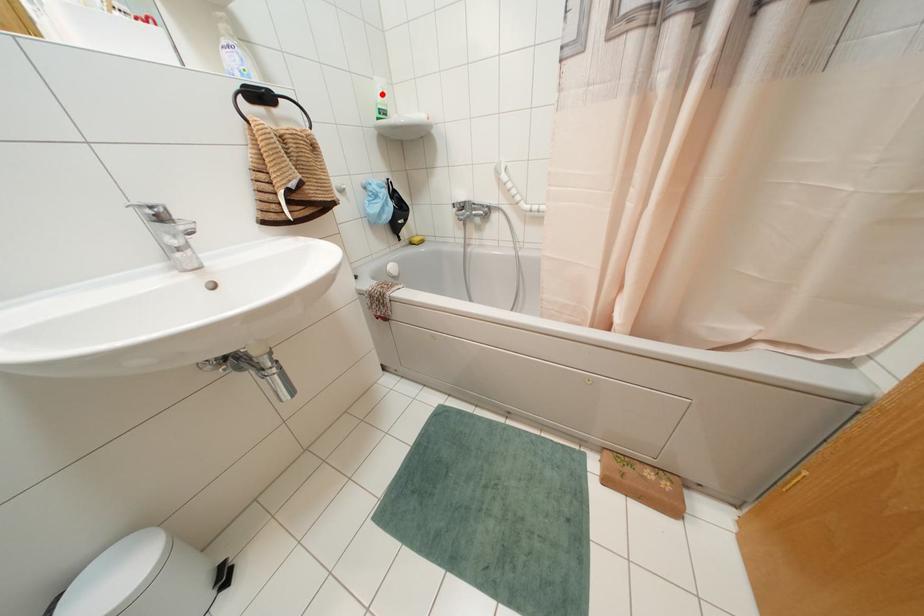
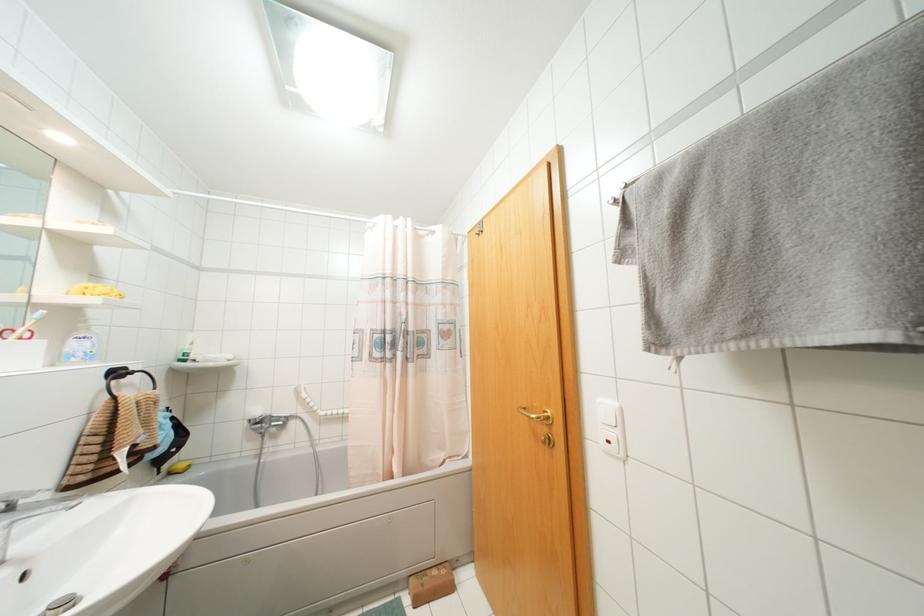
The point at the highlighted location is marked in the first image. Where is the corresponding point in the second image?

(190, 342)